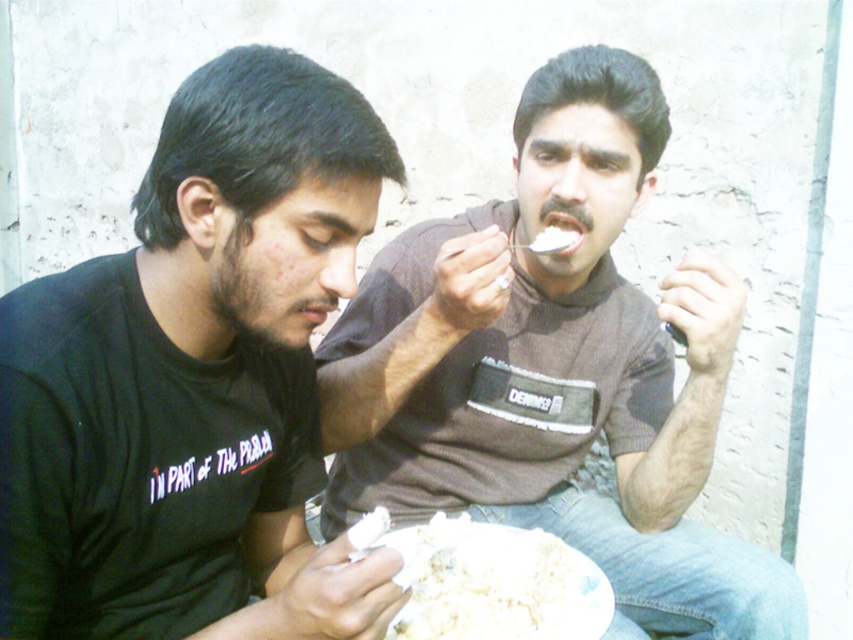
Question: Is white fluffy rice at lower center positioned behind white matte teeth at center?

Choices:
 (A) yes
 (B) no

Answer: (B)

Question: Does brown cotton shirt at center appear over matte black mouth at center?

Choices:
 (A) no
 (B) yes

Answer: (A)

Question: Which object is positioned farthest from the white fluffy rice at lower center?

Choices:
 (A) brown cotton shirt at center
 (B) white matte teeth at center

Answer: (B)

Question: Considering the real-world distances, which object is closest to the matte black mouth at center?

Choices:
 (A) black matte t-shirt at left
 (B) white fluffy rice at lower center
 (C) brown cotton shirt at center

Answer: (A)

Question: Can you confirm if black matte t-shirt at left is bigger than white matte teeth at center?

Choices:
 (A) yes
 (B) no

Answer: (A)

Question: Which object is farther from the camera taking this photo?

Choices:
 (A) white matte teeth at center
 (B) black matte t-shirt at left
 (C) matte black mouth at center

Answer: (A)